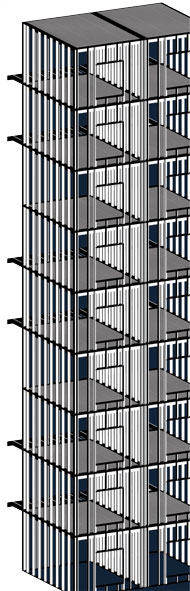
You are a GUI agent. You are given a task and a screenshot of the screen. Output one action in this format:
    pyautogui.click(x=<x>, y=<y>)
    Task: Click on the fourth floor room
    
    Given the screenshot: What is the action you would take?
    pyautogui.click(x=104, y=394), pyautogui.click(x=173, y=384)